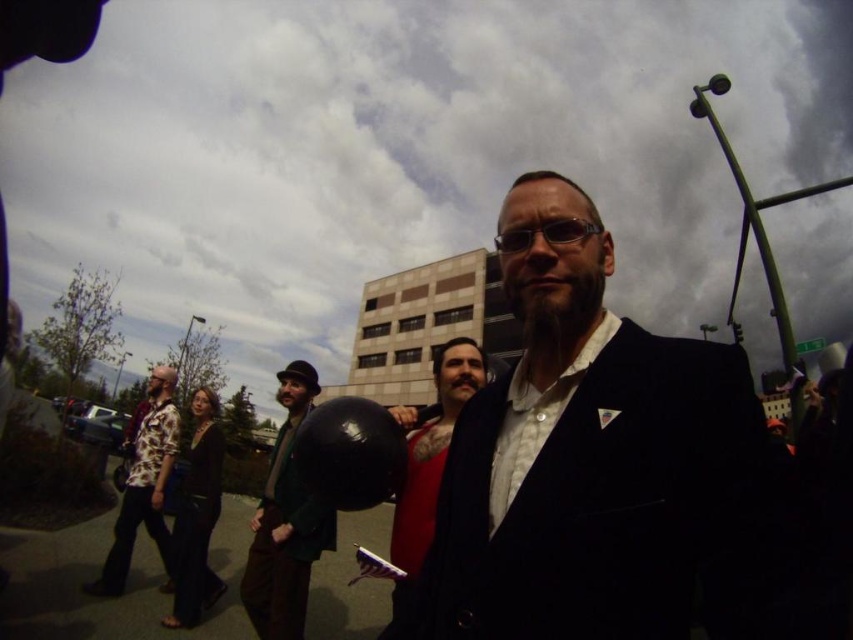
You are organizing a photo shoot and need to arrange the velvet black suit at center and the printed cotton shirt at left based on their widths. Which one should you place on the narrower side of the frame?

The velvet black suit at center has a lesser width compared to the printed cotton shirt at left, so you should place the velvet black suit at center on the narrower side of the frame.

Based on the scene description, where is the green wool coat at center located in terms of coordinates?

The green wool coat at center is located at coordinates point (285, 524).

You are standing at the origin point in the image. The point at (587, 456) corresponds to the location of the velvet black suit at center. If you want to walk towards the velvet black suit at center, which direction should you move?

The point at (587, 456) is the location of the velvet black suit at center. Since coordinates in images typically use the origin at the top left corner, moving towards higher x values means moving right and higher y values mean moving down. To reach the velvet black suit at center, you should move right and down from your current position at the origin.